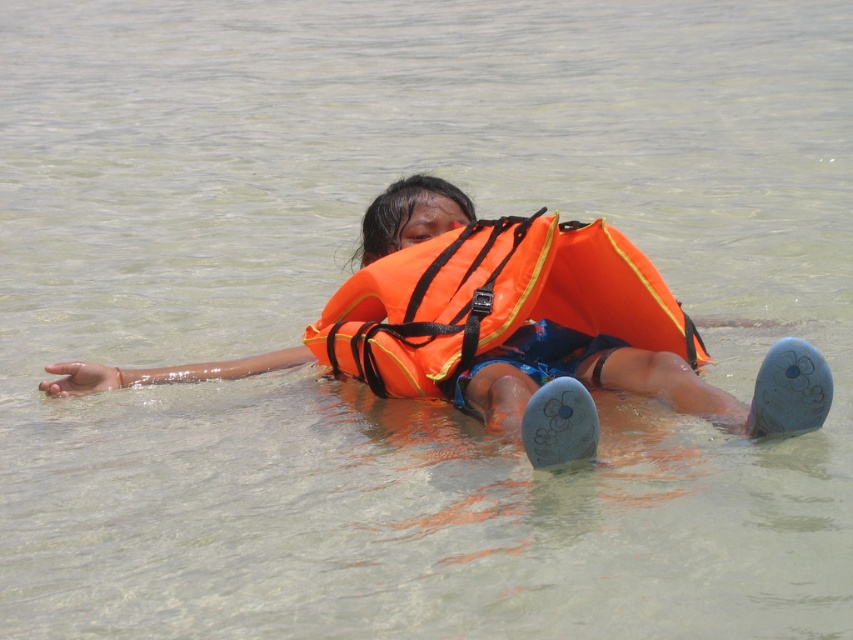
Question: Among these points, which one is farthest from the camera?

Choices:
 (A) tap(463, 204)
 (B) tap(497, 310)

Answer: (A)

Question: Is orange life vest at center positioned before orange fabric life vest at center?

Choices:
 (A) yes
 (B) no

Answer: (A)

Question: Is orange life vest at center to the right of orange fabric life vest at center from the viewer's perspective?

Choices:
 (A) no
 (B) yes

Answer: (B)

Question: Which of the following is the closest to the observer?

Choices:
 (A) (183, 365)
 (B) (670, 326)

Answer: (B)

Question: Does orange life vest at center have a lesser width compared to orange fabric life vest at center?

Choices:
 (A) yes
 (B) no

Answer: (B)

Question: Which object appears closest to the camera in this image?

Choices:
 (A) orange fabric life vest at center
 (B) orange life vest at center

Answer: (B)